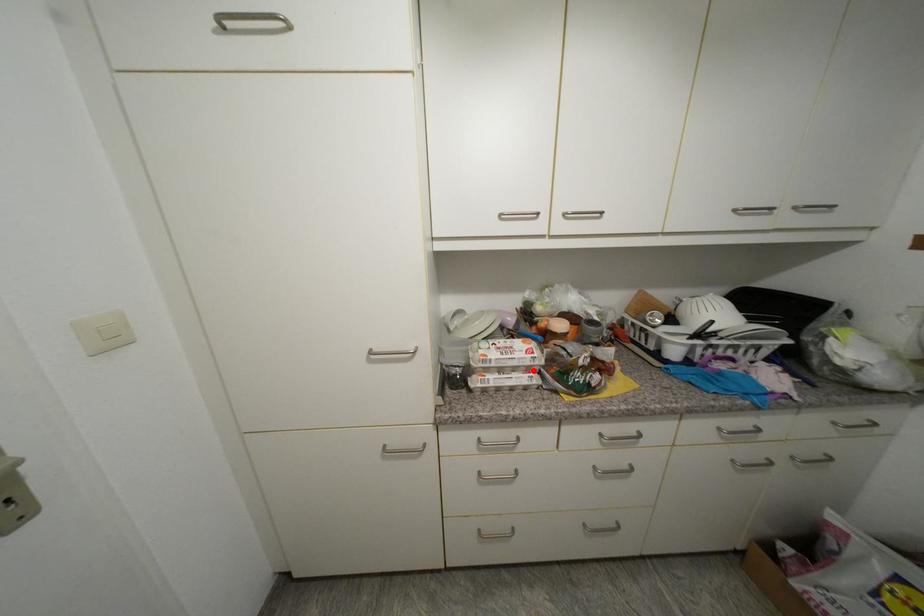
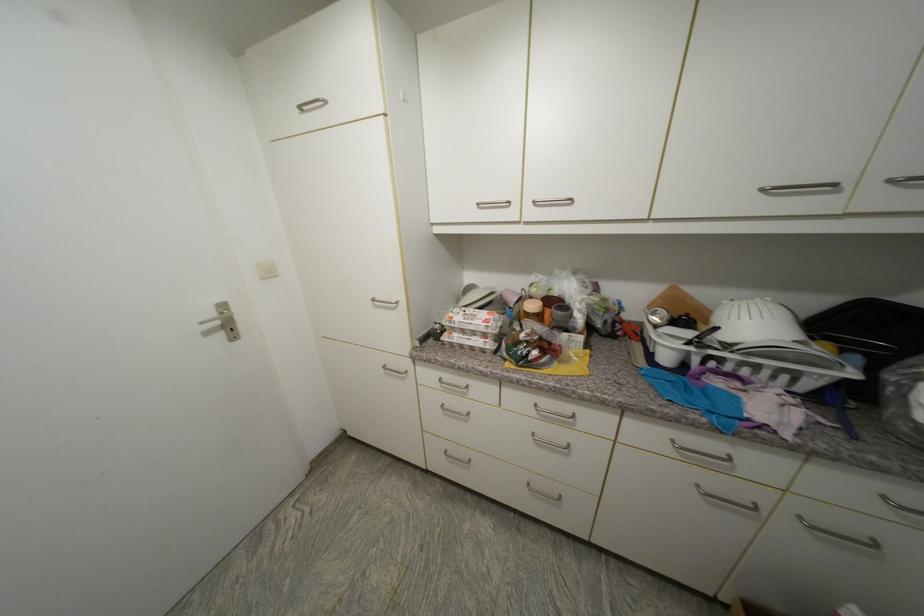
The point at the highlighted location is marked in the first image. Where is the corresponding point in the second image?

(490, 337)